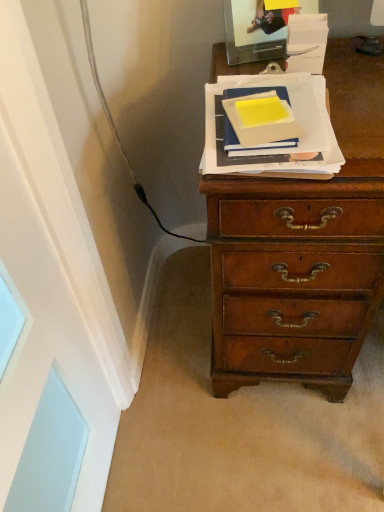
Question: Looking at the image, does blue matte book at center, which is the first paperback book from right to left, seem bigger or smaller compared to matte yellow paper at upper center, placed as the first paperback book when sorted from left to right?

Choices:
 (A) small
 (B) big

Answer: (B)

Question: From the image's perspective, is blue matte book at center, which is the first paperback book from right to left, positioned above or below matte yellow paper at upper center, the second paperback book positioned from the right?

Choices:
 (A) above
 (B) below

Answer: (B)

Question: Would you say blue matte book at center, which is the first paperback book from right to left, is inside or outside matte yellow paper at upper center, the second paperback book positioned from the right?

Choices:
 (A) outside
 (B) inside

Answer: (A)

Question: From a real-world perspective, is matte yellow paper at upper center, placed as the first paperback book when sorted from left to right, positioned above or below blue matte book at center, the second paperback book viewed from the left?

Choices:
 (A) below
 (B) above

Answer: (B)

Question: Considering the positions of matte yellow paper at upper center, the second paperback book positioned from the right, and blue matte book at center, the second paperback book viewed from the left, in the image, is matte yellow paper at upper center, the second paperback book positioned from the right, bigger or smaller than blue matte book at center, the second paperback book viewed from the left,?

Choices:
 (A) big
 (B) small

Answer: (B)

Question: Considering the relative positions of matte yellow paper at upper center, the second paperback book positioned from the right, and blue matte book at center, the second paperback book viewed from the left, in the image provided, is matte yellow paper at upper center, the second paperback book positioned from the right, to the left or to the right of blue matte book at center, the second paperback book viewed from the left,?

Choices:
 (A) left
 (B) right

Answer: (A)

Question: Is matte yellow paper at upper center, the second paperback book positioned from the right, taller or shorter than blue matte book at center, the second paperback book viewed from the left?

Choices:
 (A) tall
 (B) short

Answer: (A)